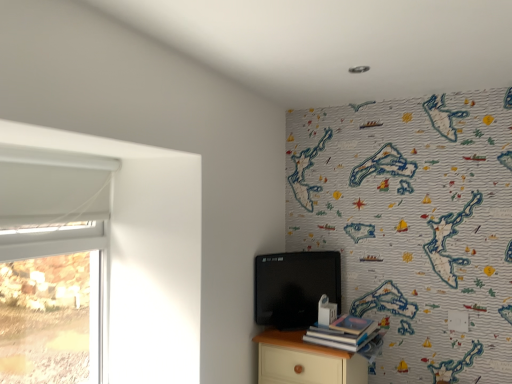
Question: Can you confirm if hardcover book at lower right is taller than white plastic window at left?

Choices:
 (A) no
 (B) yes

Answer: (A)

Question: Is hardcover book at lower right to the left of white plastic window at left from the viewer's perspective?

Choices:
 (A) no
 (B) yes

Answer: (A)

Question: From the image's perspective, is hardcover book at lower right below white plastic window at left?

Choices:
 (A) yes
 (B) no

Answer: (A)

Question: Does hardcover book at lower right touch white plastic window at left?

Choices:
 (A) yes
 (B) no

Answer: (B)

Question: Does hardcover book at lower right have a lesser width compared to white plastic window at left?

Choices:
 (A) no
 (B) yes

Answer: (A)

Question: Is white plastic window at left completely or partially inside hardcover book at lower right?

Choices:
 (A) yes
 (B) no

Answer: (B)

Question: Is hardcover book at lower right not near light wood nightstand at lower right?

Choices:
 (A) yes
 (B) no

Answer: (B)

Question: Considering the relative positions of hardcover book at lower right and light wood nightstand at lower right in the image provided, is hardcover book at lower right to the right of light wood nightstand at lower right from the viewer's perspective?

Choices:
 (A) yes
 (B) no

Answer: (A)

Question: From the image's perspective, is hardcover book at lower right under light wood nightstand at lower right?

Choices:
 (A) no
 (B) yes

Answer: (A)

Question: Does hardcover book at lower right have a smaller size compared to light wood nightstand at lower right?

Choices:
 (A) no
 (B) yes

Answer: (B)

Question: From a real-world perspective, is hardcover book at lower right below light wood nightstand at lower right?

Choices:
 (A) yes
 (B) no

Answer: (B)

Question: Does hardcover book at lower right come behind light wood nightstand at lower right?

Choices:
 (A) yes
 (B) no

Answer: (B)

Question: Is light wood nightstand at lower right not close to white plastic window at left?

Choices:
 (A) yes
 (B) no

Answer: (B)